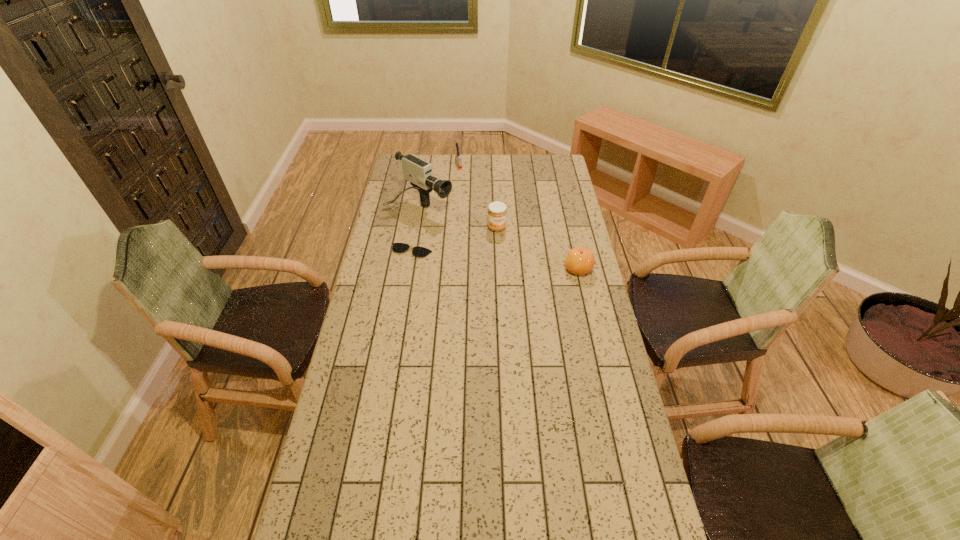
Where is `spectacles`? spectacles is located at coordinates (418, 251).

This screenshot has height=540, width=960. In order to click on the shortest object in this screenshot , I will do `click(418, 251)`.

Where is `the nearest object`? The image size is (960, 540). the nearest object is located at coordinates (579, 260).

I want to click on the rightmost object, so click(579, 260).

At what (x,y) coordinates should I click in order to perform the action: click on camcorder. Please return your answer as a coordinate pair (x, y). Looking at the image, I should click on pos(419,172).

Find the location of a particular element. The width and height of the screenshot is (960, 540). the farthest object is located at coordinates (458, 157).

Identify the location of the fourth shortest object. Image resolution: width=960 pixels, height=540 pixels. (497, 212).

At what (x,y) coordinates should I click in order to perform the action: click on jam. Please return your answer as a coordinate pair (x, y). This screenshot has width=960, height=540. Looking at the image, I should click on (497, 212).

This screenshot has width=960, height=540. In order to click on vacant space located on the back of the shortest object in this screenshot , I will do `click(419, 213)`.

The width and height of the screenshot is (960, 540). I want to click on free spot located 0.280m on the front of the nearest object, so click(592, 334).